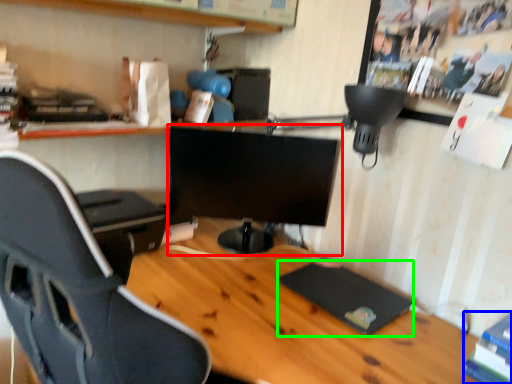
Question: Estimate the real-world distances between objects in this image. Which object is farther from computer monitor (highlighted by a red box), book (highlighted by a blue box) or pad (highlighted by a green box)?

Choices:
 (A) book
 (B) pad

Answer: (A)